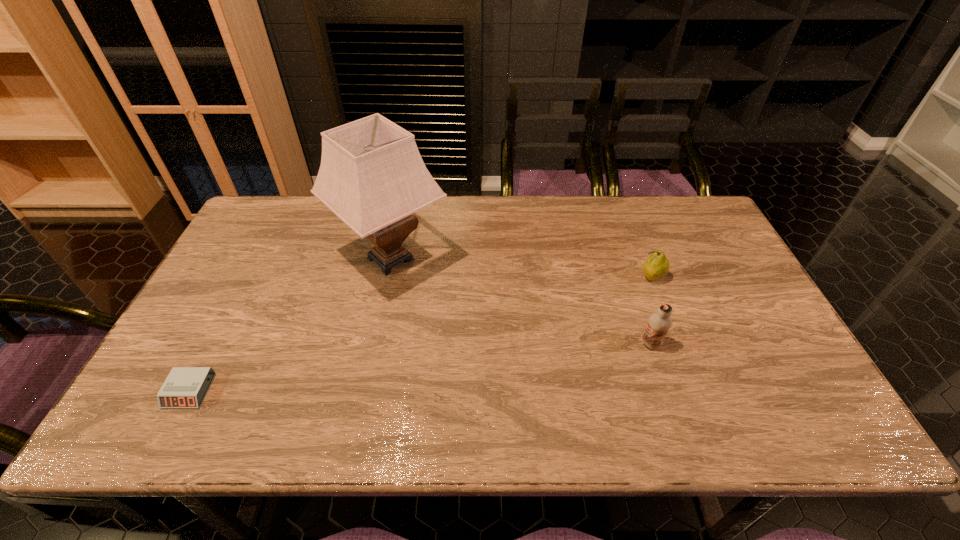
At what (x,y) coordinates should I click in order to perform the action: click on free spot between the second object from right to left and the lampshade. Please return your answer as a coordinate pair (x, y). This screenshot has height=540, width=960. Looking at the image, I should click on (520, 301).

Select which object is the second closest to the third farthest object. Please provide its 2D coordinates. Your answer should be formatted as a tuple, i.e. [(x, y)], where the tuple contains the x and y coordinates of a point satisfying the conditions above.

[(372, 176)]

Image resolution: width=960 pixels, height=540 pixels. In order to click on object that is the closest to the third tallest object in this screenshot , I will do `click(659, 323)`.